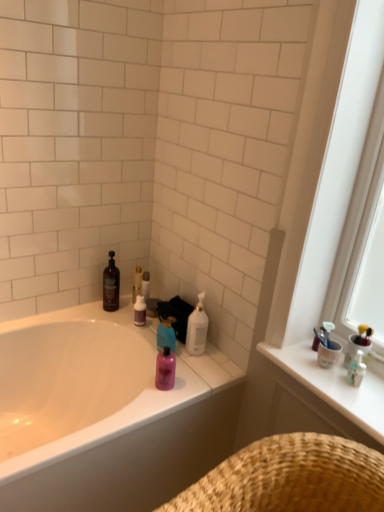
Question: From the image's perspective, relative to translucent plastic toothbrush holder at upper right, the 3th toiletry in the left-to-right sequence, is white glossy counter top at upper right above or below?

Choices:
 (A) below
 (B) above

Answer: (A)

Question: Is point coord(339,352) positioned closer to the camera than point coord(362,369)?

Choices:
 (A) closer
 (B) farther

Answer: (B)

Question: Which of these objects is positioned closest to the pink glossy bottle at center, the second toiletry viewed from the back?

Choices:
 (A) matte white bathtub at center
 (B) white glossy counter top at upper right
 (C) white matte toilet paper at upper center
 (D) translucent plastic toothbrush holder at upper right, the 1th toiletry from the right
 (E) blue glossy bottle at center, which ranks as the second cleaning product in left-to-right order

Answer: (E)

Question: Estimate the real-world distances between objects in this image. Which object is closer to the pink glossy bottle at center, the second toiletry positioned from the front?

Choices:
 (A) white matte toilet paper at upper center
 (B) matte black bottle at upper left, arranged as the third cleaning product when viewed from the right
 (C) white glossy bottle at upper center, which appears as the third cleaning product when viewed from the left
 (D) translucent plastic toothbrush holder at upper right, the 1th toiletry from the right
 (E) blue glossy bottle at center, arranged as the 2th cleaning product when viewed from the right

Answer: (E)